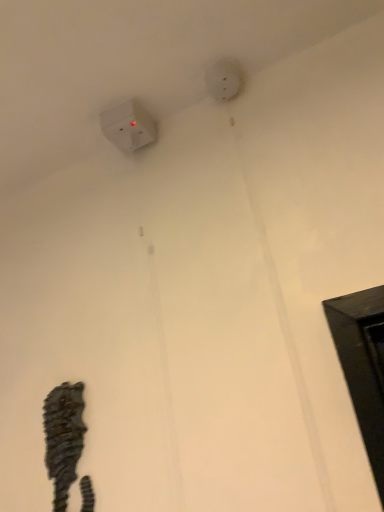
Question: From their relative heights in the image, would you say rustic wood seahorse at lower left is taller or shorter than white matte electric outlet at upper center?

Choices:
 (A) tall
 (B) short

Answer: (A)

Question: Do you think rustic wood seahorse at lower left is within white matte electric outlet at upper center, or outside of it?

Choices:
 (A) outside
 (B) inside

Answer: (A)

Question: Based on their relative distances, which object is nearer to the rustic wood seahorse at lower left?

Choices:
 (A) white plastic power plug at upper left
 (B) white matte electric outlet at upper center

Answer: (A)

Question: Based on their relative distances, which object is farther from the white matte electric outlet at upper center?

Choices:
 (A) rustic wood seahorse at lower left
 (B) white plastic power plug at upper left

Answer: (A)